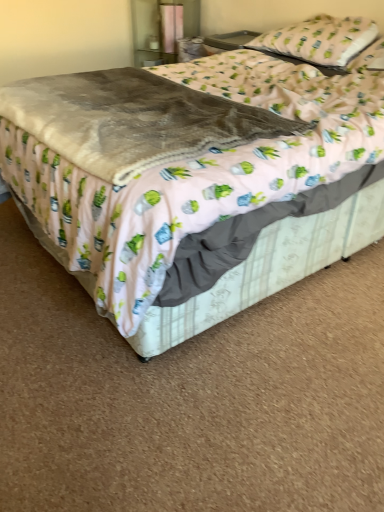
Question: Should I look upward or downward to see white fabric pillow at upper right, the second pillow ordered from the bottom?

Choices:
 (A) down
 (B) up

Answer: (B)

Question: Can you see white fabric pillow at upper right, acting as the first pillow starting from the top, touching white fabric pillow at upper right, which is counted as the second pillow, starting from the top?

Choices:
 (A) yes
 (B) no

Answer: (B)

Question: Is white fabric pillow at upper right, which is counted as the second pillow, starting from the top, at the back of white fabric pillow at upper right, acting as the first pillow starting from the top?

Choices:
 (A) yes
 (B) no

Answer: (B)

Question: From the image's perspective, is white fabric pillow at upper right, acting as the first pillow starting from the top, above white fabric pillow at upper right, positioned as the 1th pillow in bottom-to-top order?

Choices:
 (A) no
 (B) yes

Answer: (B)

Question: Does white fabric pillow at upper right, the second pillow ordered from the bottom, have a larger size compared to white fabric pillow at upper right, which is counted as the second pillow, starting from the top?

Choices:
 (A) no
 (B) yes

Answer: (B)

Question: Is white fabric pillow at upper right, acting as the first pillow starting from the top, located outside white fabric pillow at upper right, which is counted as the second pillow, starting from the top?

Choices:
 (A) no
 (B) yes

Answer: (B)

Question: Can you confirm if white fabric pillow at upper right, acting as the first pillow starting from the top, is shorter than white fabric pillow at upper right, which is counted as the second pillow, starting from the top?

Choices:
 (A) no
 (B) yes

Answer: (A)

Question: Is white fabric pillow at upper right, which is counted as the second pillow, starting from the top, not close to velvety gray blanket at center?

Choices:
 (A) yes
 (B) no

Answer: (A)

Question: Does white fabric pillow at upper right, positioned as the 1th pillow in bottom-to-top order, have a lesser width compared to velvety gray blanket at center?

Choices:
 (A) no
 (B) yes

Answer: (B)

Question: Is white fabric pillow at upper right, which is counted as the second pillow, starting from the top, at the right side of velvety gray blanket at center?

Choices:
 (A) no
 (B) yes

Answer: (B)

Question: Does white fabric pillow at upper right, positioned as the 1th pillow in bottom-to-top order, lie behind velvety gray blanket at center?

Choices:
 (A) no
 (B) yes

Answer: (B)

Question: Can you confirm if white fabric pillow at upper right, positioned as the 1th pillow in bottom-to-top order, is positioned to the left of velvety gray blanket at center?

Choices:
 (A) no
 (B) yes

Answer: (A)

Question: From a real-world perspective, is white fabric pillow at upper right, which is counted as the second pillow, starting from the top, positioned under velvety gray blanket at center based on gravity?

Choices:
 (A) no
 (B) yes

Answer: (A)

Question: Is velvet gray blanket at center closer to camera compared to velvety gray blanket at center?

Choices:
 (A) no
 (B) yes

Answer: (B)